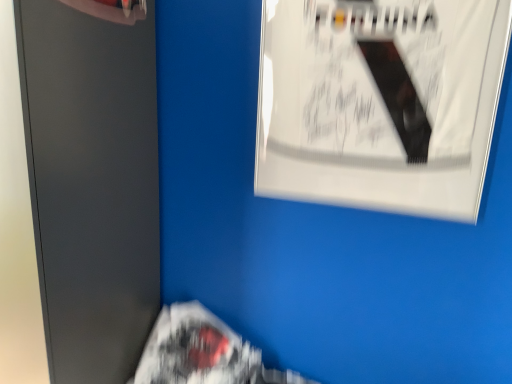
Question: Are white paper flyer at lower center and matte gray file cabinet at left far apart?

Choices:
 (A) yes
 (B) no

Answer: (B)

Question: Is white paper flyer at lower center smaller than matte gray file cabinet at left?

Choices:
 (A) yes
 (B) no

Answer: (A)

Question: Does white paper flyer at lower center appear on the left side of matte gray file cabinet at left?

Choices:
 (A) yes
 (B) no

Answer: (B)

Question: Does white paper flyer at lower center have a larger size compared to matte gray file cabinet at left?

Choices:
 (A) no
 (B) yes

Answer: (A)

Question: Is white paper flyer at lower center behind matte gray file cabinet at left?

Choices:
 (A) no
 (B) yes

Answer: (B)

Question: Does white paper flyer at lower center have a greater height compared to matte gray file cabinet at left?

Choices:
 (A) no
 (B) yes

Answer: (A)

Question: Is matte gray file cabinet at left far away from white paper flyer at lower center?

Choices:
 (A) yes
 (B) no

Answer: (B)

Question: Is matte gray file cabinet at left positioned with its back to white paper flyer at lower center?

Choices:
 (A) yes
 (B) no

Answer: (B)

Question: Considering the relative sizes of matte gray file cabinet at left and white paper flyer at lower center in the image provided, is matte gray file cabinet at left bigger than white paper flyer at lower center?

Choices:
 (A) no
 (B) yes

Answer: (B)

Question: Is matte gray file cabinet at left to the left of white paper flyer at lower center from the viewer's perspective?

Choices:
 (A) no
 (B) yes

Answer: (B)

Question: From the image's perspective, is matte gray file cabinet at left under white paper flyer at lower center?

Choices:
 (A) no
 (B) yes

Answer: (A)

Question: Considering the relative positions of matte gray file cabinet at left and white paper flyer at lower center in the image provided, is matte gray file cabinet at left to the right of white paper flyer at lower center from the viewer's perspective?

Choices:
 (A) yes
 (B) no

Answer: (B)

Question: Is the position of matte gray file cabinet at left less distant than that of white glossy poster at upper right?

Choices:
 (A) no
 (B) yes

Answer: (B)